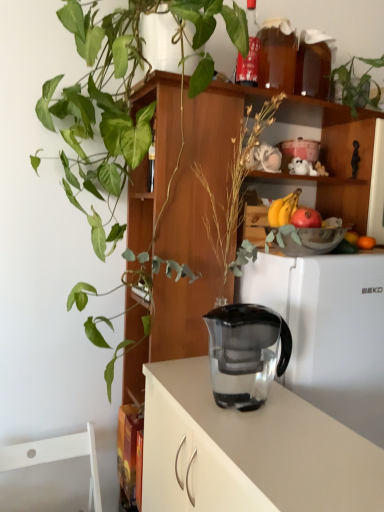
Question: Is white matte refrigerator at center not close to transparent glass pitcher at center?

Choices:
 (A) yes
 (B) no

Answer: (B)

Question: Could transparent glass pitcher at center be considered to be inside white matte refrigerator at center?

Choices:
 (A) yes
 (B) no

Answer: (B)

Question: Is white matte refrigerator at center at the right side of transparent glass pitcher at center?

Choices:
 (A) yes
 (B) no

Answer: (A)

Question: From a real-world perspective, does white matte refrigerator at center sit lower than transparent glass pitcher at center?

Choices:
 (A) yes
 (B) no

Answer: (B)

Question: Is white matte refrigerator at center to the left of transparent glass pitcher at center from the viewer's perspective?

Choices:
 (A) no
 (B) yes

Answer: (A)

Question: Would you say white matte refrigerator at center is outside transparent glass pitcher at center?

Choices:
 (A) no
 (B) yes

Answer: (B)

Question: Is green glossy plant at upper left, arranged as the second houseplant when viewed from the right, positioned with its back to transparent glass vase at center?

Choices:
 (A) yes
 (B) no

Answer: (B)

Question: Does green glossy plant at upper left, the first houseplant viewed from the left, contain transparent glass vase at center?

Choices:
 (A) no
 (B) yes

Answer: (B)

Question: Is green glossy plant at upper left, arranged as the second houseplant when viewed from the right, positioned in front of transparent glass vase at center?

Choices:
 (A) no
 (B) yes

Answer: (B)

Question: Is green glossy plant at upper left, the first houseplant viewed from the left, thinner than transparent glass vase at center?

Choices:
 (A) no
 (B) yes

Answer: (A)

Question: Is green glossy plant at upper left, the first houseplant viewed from the left, touching transparent glass vase at center?

Choices:
 (A) yes
 (B) no

Answer: (B)

Question: From the image's perspective, is green glossy plant at upper left, arranged as the second houseplant when viewed from the right, beneath transparent glass vase at center?

Choices:
 (A) no
 (B) yes

Answer: (A)

Question: From a real-world perspective, is red matte apple at upper right located beneath transparent plastic jug at center?

Choices:
 (A) yes
 (B) no

Answer: (B)